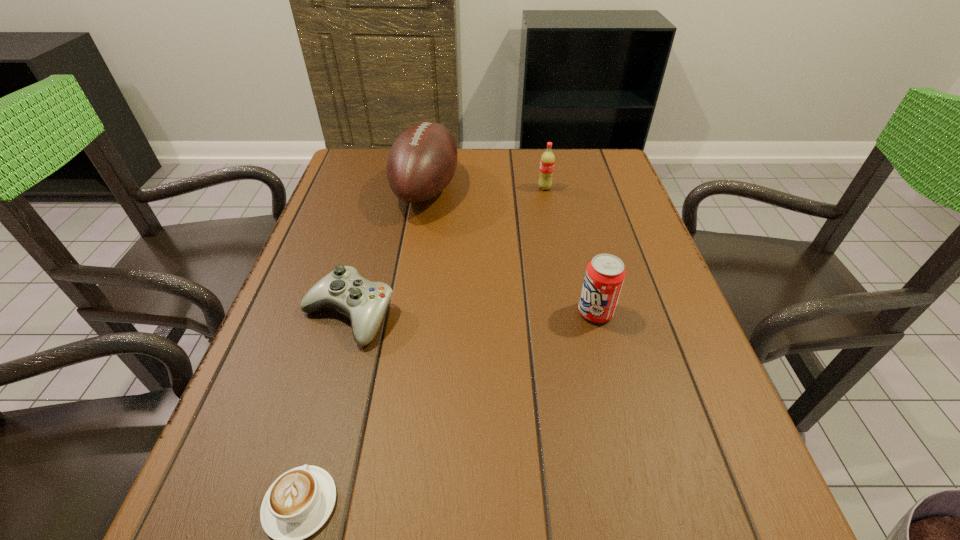
What are the coordinates of `the tallest object` in the screenshot? It's located at coord(422,161).

Identify the location of the farther soda can. This screenshot has height=540, width=960. (547, 161).

Find the location of a particular element. The height and width of the screenshot is (540, 960). the nearer soda can is located at coordinates click(x=605, y=274).

I want to click on control, so click(364, 302).

Image resolution: width=960 pixels, height=540 pixels. Find the location of `vacant space located on the front of the football (American)`. vacant space located on the front of the football (American) is located at coordinates (404, 329).

At what (x,y) coordinates should I click in order to perform the action: click on vacant region located on the back of the farther soda can. Please return your answer as a coordinate pair (x, y). Looking at the image, I should click on (542, 175).

Image resolution: width=960 pixels, height=540 pixels. Find the location of `vacant area situated 0.280m on the surface of the nearer soda can`. vacant area situated 0.280m on the surface of the nearer soda can is located at coordinates (445, 312).

Find the location of `vacant space located on the surface of the nearer soda can`. vacant space located on the surface of the nearer soda can is located at coordinates (441, 312).

The image size is (960, 540). Find the location of `free location located on the surface of the nearer soda can`. free location located on the surface of the nearer soda can is located at coordinates (492, 312).

You are a GUI agent. You are given a task and a screenshot of the screen. Output one action in this format:
    pyautogui.click(x=<x>, y=<y>)
    Task: Click on the vacant space located 0.080m on the right of the second shortest object
    This screenshot has height=540, width=960.
    Given the screenshot: What is the action you would take?
    pyautogui.click(x=433, y=315)